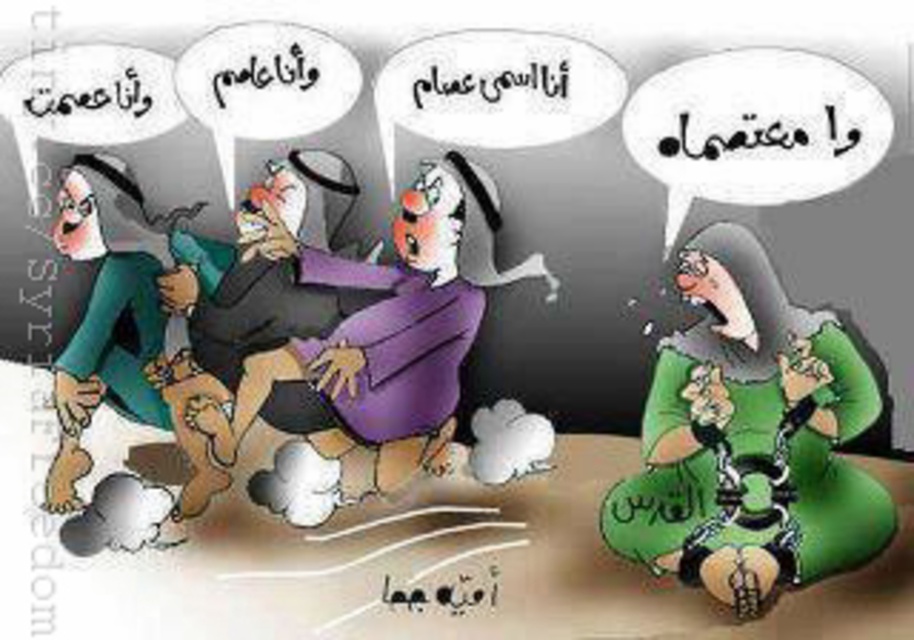
You are an observer looking at the image. Which of the two green dresses, the green matte dress at lower right or the matte green dress at left, is taller?

The green matte dress at lower right is taller than the matte green dress at left.

In the image, there are two dresses depicted. The purple matte dress at center and the matte green dress at left. Which dress is taller?

The purple matte dress at center is taller than the matte green dress at left.

Based on the scene description, which object is taller between the green matte dress at lower right and the purple matte dress at center?

The green matte dress at lower right is taller than the purple matte dress at center.